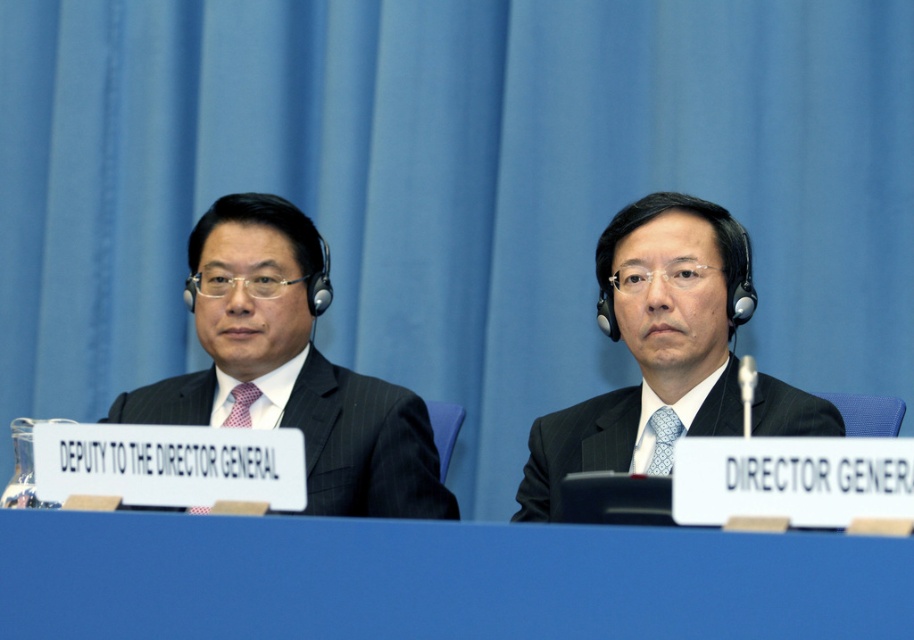
You are organizing a meeting and need to place a 12 cm tall document holder on the blue plastic table at center. Considering the height of the matte black suit at center, will the document holder be visible to someone sitting across the table?

The blue plastic table at center is not as tall as the matte black suit at center. Since the document holder is only 12 cm tall, it may be partially obscured by the taller matte black suit at center, making it less visible to someone sitting across the table.

You are a photographer standing behind the matte black suit at center. You want to take a photo of both individuals without moving. Can you capture both of them in the same frame?

The individuals are 6.56 feet apart, so yes, the photographer can capture both in the same frame as they are within a reasonable distance.

You are organizing a formal event and need to ensure that all attire meets specific size requirements. Given the image provided, which object between the matte black suit at center and the red checkered tie at left is larger in size?

The matte black suit at center is larger in size than the red checkered tie at left according to the description.